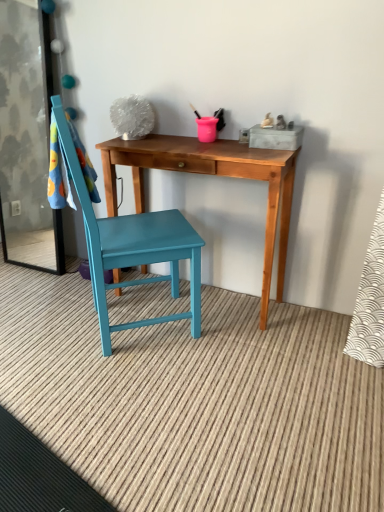
Where is `free spot to the right of teal painted wood chair at center`? Image resolution: width=384 pixels, height=512 pixels. free spot to the right of teal painted wood chair at center is located at coordinates (243, 347).